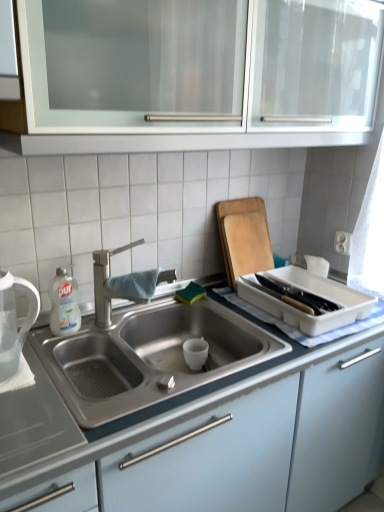
Question: Does satin nickel faucet at center have a lesser width compared to white glossy bottle at left?

Choices:
 (A) no
 (B) yes

Answer: (A)

Question: Is satin nickel faucet at center positioned far away from white glossy bottle at left?

Choices:
 (A) yes
 (B) no

Answer: (B)

Question: Are satin nickel faucet at center and white glossy bottle at left making contact?

Choices:
 (A) no
 (B) yes

Answer: (A)

Question: Is satin nickel faucet at center looking in the opposite direction of white glossy bottle at left?

Choices:
 (A) yes
 (B) no

Answer: (B)

Question: From a real-world perspective, is satin nickel faucet at center located higher than white glossy bottle at left?

Choices:
 (A) yes
 (B) no

Answer: (A)

Question: Is satin nickel faucet at center to the right of white glossy bottle at left from the viewer's perspective?

Choices:
 (A) no
 (B) yes

Answer: (B)

Question: Is white matte tea pot at left facing towards wooden cutting board at upper right?

Choices:
 (A) no
 (B) yes

Answer: (A)

Question: From the image's perspective, is white matte tea pot at left above wooden cutting board at upper right?

Choices:
 (A) no
 (B) yes

Answer: (A)

Question: Can you confirm if white matte tea pot at left is taller than wooden cutting board at upper right?

Choices:
 (A) yes
 (B) no

Answer: (B)

Question: Is white matte tea pot at left thinner than wooden cutting board at upper right?

Choices:
 (A) no
 (B) yes

Answer: (A)

Question: Can you confirm if white matte tea pot at left is shorter than wooden cutting board at upper right?

Choices:
 (A) yes
 (B) no

Answer: (A)

Question: Is white matte tea pot at left positioned far away from wooden cutting board at upper right?

Choices:
 (A) no
 (B) yes

Answer: (A)

Question: Is white glass cabinet at upper center, the first cabinetry positioned from the top, to the right of wooden cutting board at upper right from the viewer's perspective?

Choices:
 (A) no
 (B) yes

Answer: (A)